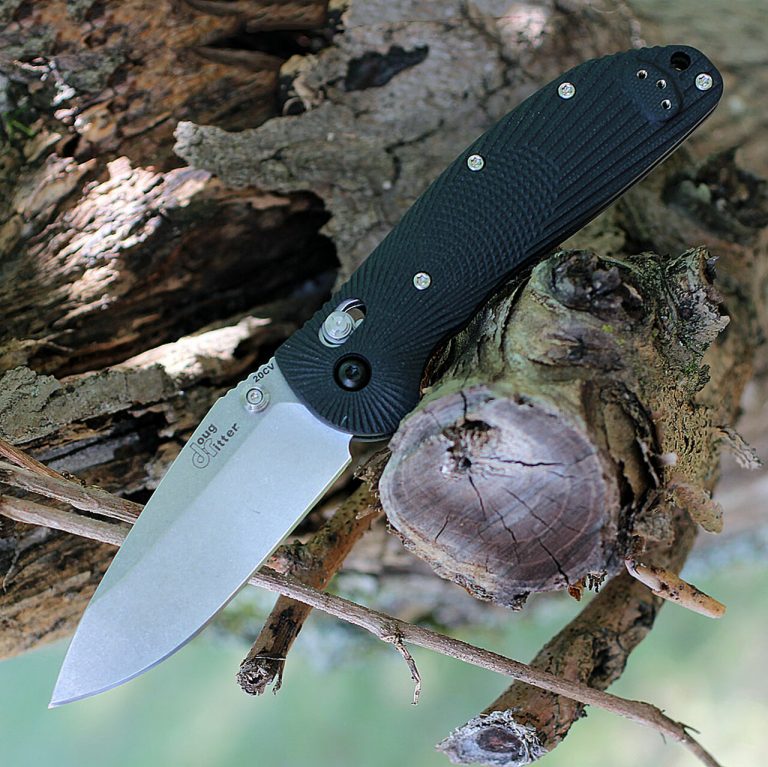
This screenshot has width=768, height=767. I want to click on black screw, so click(x=356, y=376).